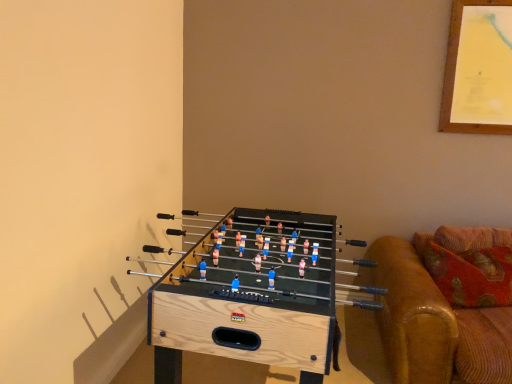
Locate an element on the screen. This screenshot has width=512, height=384. natural wood foosball table at lower left is located at coordinates tap(251, 296).

Image resolution: width=512 pixels, height=384 pixels. What do you see at coordinates (251, 296) in the screenshot? I see `natural wood foosball table at lower left` at bounding box center [251, 296].

What do you see at coordinates (439, 315) in the screenshot?
I see `brown leather couch at right` at bounding box center [439, 315].

Where is `brown leather couch at right`? The width and height of the screenshot is (512, 384). brown leather couch at right is located at coordinates (439, 315).

At what (x,y) coordinates should I click in order to perform the action: click on natural wood foosball table at lower left. Please return your answer as a coordinate pair (x, y). The width and height of the screenshot is (512, 384). Looking at the image, I should click on (251, 296).

Between brown leather couch at right and natural wood foosball table at lower left, which one appears on the right side from the viewer's perspective?

From the viewer's perspective, brown leather couch at right appears more on the right side.

Is brown leather couch at right further to the viewer compared to natural wood foosball table at lower left?

Yes, brown leather couch at right is further from the camera.

Between point (409, 290) and point (274, 347), which one is positioned in front?

The point (274, 347) is closer to the camera.

Looking at this image, from the image's perspective, is brown leather couch at right on top of natural wood foosball table at lower left?

Yes.

From a real-world perspective, is brown leather couch at right positioned over natural wood foosball table at lower left based on gravity?

Yes.

Is brown leather couch at right wider or thinner than natural wood foosball table at lower left?

In the image, brown leather couch at right appears to be more narrow than natural wood foosball table at lower left.

Consider the image. Between brown leather couch at right and natural wood foosball table at lower left, which one has more height?

natural wood foosball table at lower left is taller.

Considering the relative sizes of brown leather couch at right and natural wood foosball table at lower left in the image provided, is brown leather couch at right smaller than natural wood foosball table at lower left?

Yes, brown leather couch at right is smaller than natural wood foosball table at lower left.

Would you say brown leather couch at right is outside natural wood foosball table at lower left?

That's correct, brown leather couch at right is outside of natural wood foosball table at lower left.

Are brown leather couch at right and natural wood foosball table at lower left making contact?

No, brown leather couch at right is not next to natural wood foosball table at lower left.

Is brown leather couch at right aimed at natural wood foosball table at lower left?

No, brown leather couch at right is not facing towards natural wood foosball table at lower left.

Looking at this image, how different are the orientations of brown leather couch at right and natural wood foosball table at lower left in degrees?

There is a 78.7-degree angle between the facing directions of brown leather couch at right and natural wood foosball table at lower left.

Locate an element on the screen. studio couch above the natural wood foosball table at lower left (from a real-world perspective) is located at coordinates (439, 315).

Does natural wood foosball table at lower left appear on the right side of brown leather couch at right?

Incorrect, natural wood foosball table at lower left is not on the right side of brown leather couch at right.

Does natural wood foosball table at lower left come behind brown leather couch at right?

No, natural wood foosball table at lower left is closer to the viewer.

Considering the points (263, 248) and (456, 328), which point is in front, point (263, 248) or point (456, 328)?

Point (456, 328)

From the image's perspective, is natural wood foosball table at lower left above brown leather couch at right?

No, from the image's perspective, natural wood foosball table at lower left is not above brown leather couch at right.

From a real-world perspective, which object stands above the other?

brown leather couch at right, from a real-world perspective.

Is natural wood foosball table at lower left thinner than brown leather couch at right?

Incorrect, the width of natural wood foosball table at lower left is not less than that of brown leather couch at right.

Based on the photo, considering the sizes of objects natural wood foosball table at lower left and brown leather couch at right in the image provided, who is taller, natural wood foosball table at lower left or brown leather couch at right?

natural wood foosball table at lower left.

Looking at this image, is natural wood foosball table at lower left smaller than brown leather couch at right?

Actually, natural wood foosball table at lower left might be larger than brown leather couch at right.

Is natural wood foosball table at lower left not inside brown leather couch at right?

natural wood foosball table at lower left lies outside brown leather couch at right's area.

In the scene shown: Are natural wood foosball table at lower left and brown leather couch at right making contact?

No, natural wood foosball table at lower left is not making contact with brown leather couch at right.

Could you tell me if natural wood foosball table at lower left is turned towards brown leather couch at right?

Yes.

How many degrees apart are the facing directions of natural wood foosball table at lower left and brown leather couch at right?

78.7 degrees.

Where is `furniture on the left of brown leather couch at right`? Image resolution: width=512 pixels, height=384 pixels. furniture on the left of brown leather couch at right is located at coordinates (251, 296).

Locate an element on the screen. furniture lying below the brown leather couch at right (from the image's perspective) is located at coordinates (251, 296).

I want to click on studio couch above the natural wood foosball table at lower left (from the image's perspective), so [439, 315].